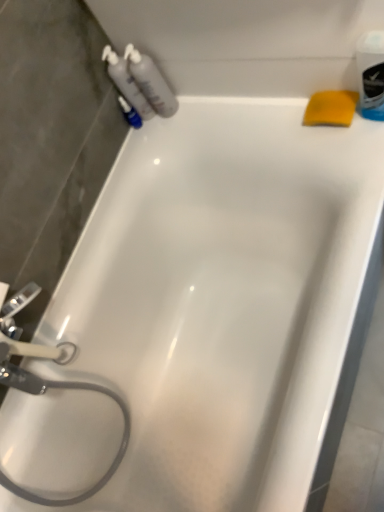
I want to click on free area in between translucent plastic bottles at upper left, acting as the second cleaning product starting from the left, and blue plastic mouthwash at upper right, so click(241, 111).